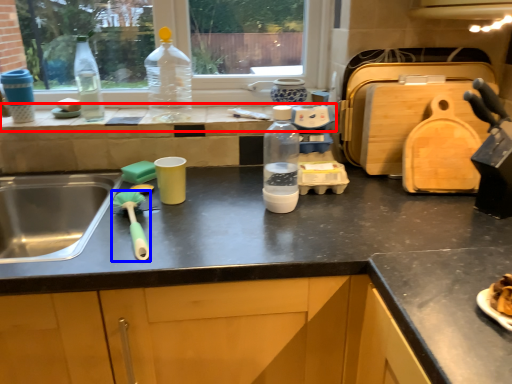
Question: Which point is further to the camera, window sill (highlighted by a red box) or brush (highlighted by a blue box)?

Choices:
 (A) window sill
 (B) brush

Answer: (A)